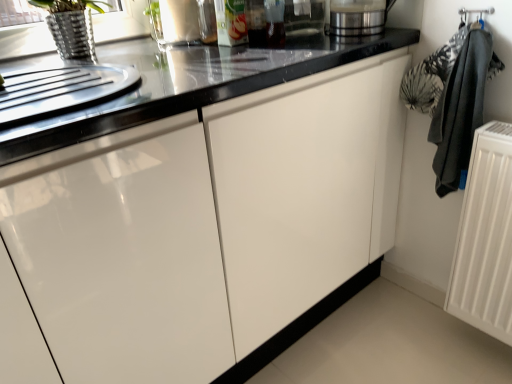
Question: Are white matte radiator at right and metallic glass at upper center, the 1th appliance from the left, located far from each other?

Choices:
 (A) no
 (B) yes

Answer: (A)

Question: Considering the relative positions of white matte radiator at right and metallic glass at upper center, the 1th appliance from the left, in the image provided, is white matte radiator at right to the right of metallic glass at upper center, the 1th appliance from the left, from the viewer's perspective?

Choices:
 (A) yes
 (B) no

Answer: (A)

Question: Is the depth of white matte radiator at right greater than that of metallic glass at upper center, the 2th appliance in the right-to-left sequence?

Choices:
 (A) yes
 (B) no

Answer: (B)

Question: Considering the relative positions of white matte radiator at right and metallic glass at upper center, the 1th appliance from the left, in the image provided, is white matte radiator at right in front of metallic glass at upper center, the 1th appliance from the left,?

Choices:
 (A) no
 (B) yes

Answer: (B)

Question: Considering the relative sizes of white matte radiator at right and metallic glass at upper center, the 1th appliance from the left, in the image provided, is white matte radiator at right bigger than metallic glass at upper center, the 1th appliance from the left,?

Choices:
 (A) yes
 (B) no

Answer: (A)

Question: From the image's perspective, is white matte radiator at right over metallic glass at upper center, the 2th appliance in the right-to-left sequence?

Choices:
 (A) no
 (B) yes

Answer: (A)

Question: From a real-world perspective, is metallic glass at upper center, the 2th appliance in the right-to-left sequence, below satin silver blender at upper right, arranged as the second appliance when viewed from the left?

Choices:
 (A) yes
 (B) no

Answer: (B)

Question: Is satin silver blender at upper right, arranged as the second appliance when viewed from the left, completely or partially inside metallic glass at upper center, the 2th appliance in the right-to-left sequence?

Choices:
 (A) no
 (B) yes

Answer: (A)

Question: Is metallic glass at upper center, the 1th appliance from the left, facing away from satin silver blender at upper right, the 1th appliance positioned from the right?

Choices:
 (A) yes
 (B) no

Answer: (B)

Question: Is metallic glass at upper center, the 2th appliance in the right-to-left sequence, completely or partially outside of satin silver blender at upper right, the 1th appliance positioned from the right?

Choices:
 (A) no
 (B) yes

Answer: (B)

Question: Is the position of metallic glass at upper center, the 1th appliance from the left, more distant than that of satin silver blender at upper right, the 1th appliance positioned from the right?

Choices:
 (A) no
 (B) yes

Answer: (B)

Question: Is metallic glass at upper center, the 2th appliance in the right-to-left sequence, not close to satin silver blender at upper right, the 1th appliance positioned from the right?

Choices:
 (A) no
 (B) yes

Answer: (A)

Question: Is black fabric laundry at right oriented towards satin silver blender at upper right, arranged as the second appliance when viewed from the left?

Choices:
 (A) no
 (B) yes

Answer: (A)